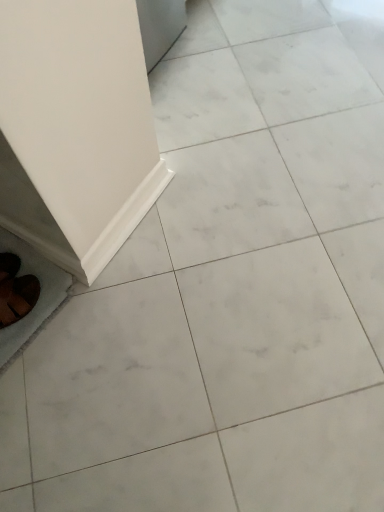
Question: Considering the positions of white glossy ceramic tile at lower left, the first ceramic tile viewed from the left, and white glossy baseboard at lower left, which appears as the 1th ceramic tile when viewed from the right, in the image, is white glossy ceramic tile at lower left, the first ceramic tile viewed from the left, bigger or smaller than white glossy baseboard at lower left, which appears as the 1th ceramic tile when viewed from the right,?

Choices:
 (A) small
 (B) big

Answer: (B)

Question: Is white glossy ceramic tile at lower left, which appears as the 2th ceramic tile when viewed from the right, spatially inside white glossy baseboard at lower left, which appears as the 1th ceramic tile when viewed from the right, or outside of it?

Choices:
 (A) inside
 (B) outside

Answer: (B)

Question: Considering the real-world distances, which object is farthest from the white glossy ceramic tile at lower left, the first ceramic tile viewed from the left?

Choices:
 (A) brown suede shoes at lower left
 (B) white glossy baseboard at lower left, which appears as the 1th ceramic tile when viewed from the right

Answer: (B)

Question: Which object is the closest to the white glossy baseboard at lower left, which appears as the 1th ceramic tile when viewed from the right?

Choices:
 (A) brown suede shoes at lower left
 (B) white glossy ceramic tile at lower left, the first ceramic tile viewed from the left

Answer: (B)